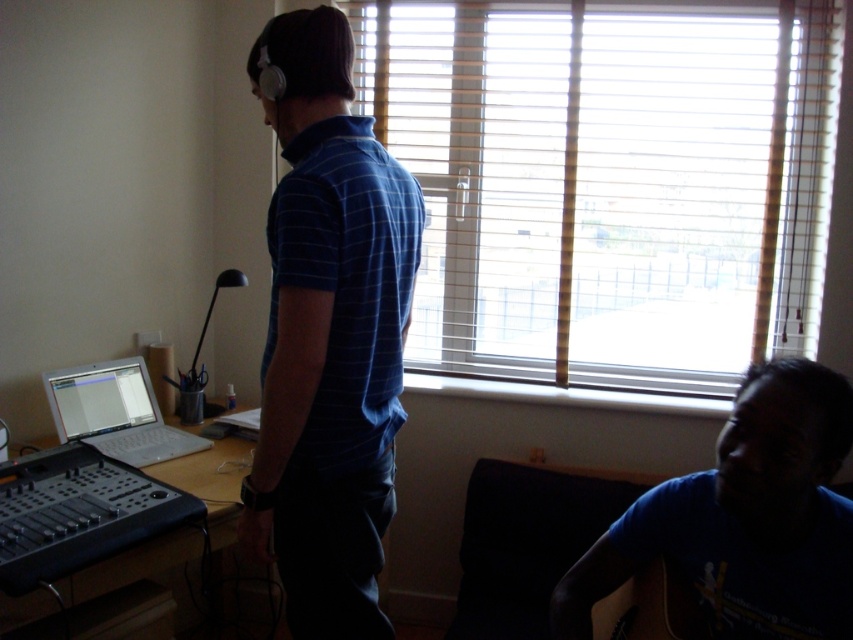
Can you confirm if wooden blinds at upper center is taller than silver metallic laptop at left?

Indeed, wooden blinds at upper center has a greater height compared to silver metallic laptop at left.

Who is positioned more to the right, wooden blinds at upper center or silver metallic laptop at left?

wooden blinds at upper center is more to the right.

Is point (833, 164) positioned behind point (67, 422)?

Yes, point (833, 164) is behind point (67, 422).

Locate an element on the screen. The height and width of the screenshot is (640, 853). wooden blinds at upper center is located at coordinates (612, 180).

Which is more to the right, blue plaid shirt at center or blue cotton shirt at lower right?

blue cotton shirt at lower right is more to the right.

Which is above, blue plaid shirt at center or blue cotton shirt at lower right?

blue plaid shirt at center

Is point (277, 506) closer to viewer compared to point (814, 500)?

No, (277, 506) is behind (814, 500).

Where is `blue plaid shirt at center`? The width and height of the screenshot is (853, 640). blue plaid shirt at center is located at coordinates (328, 333).

The height and width of the screenshot is (640, 853). Describe the element at coordinates (612, 180) in the screenshot. I see `wooden blinds at upper center` at that location.

Is wooden blinds at upper center positioned in front of blue plaid shirt at center?

That is False.

Describe the element at coordinates (612, 180) in the screenshot. I see `wooden blinds at upper center` at that location.

The height and width of the screenshot is (640, 853). I want to click on wooden blinds at upper center, so click(x=612, y=180).